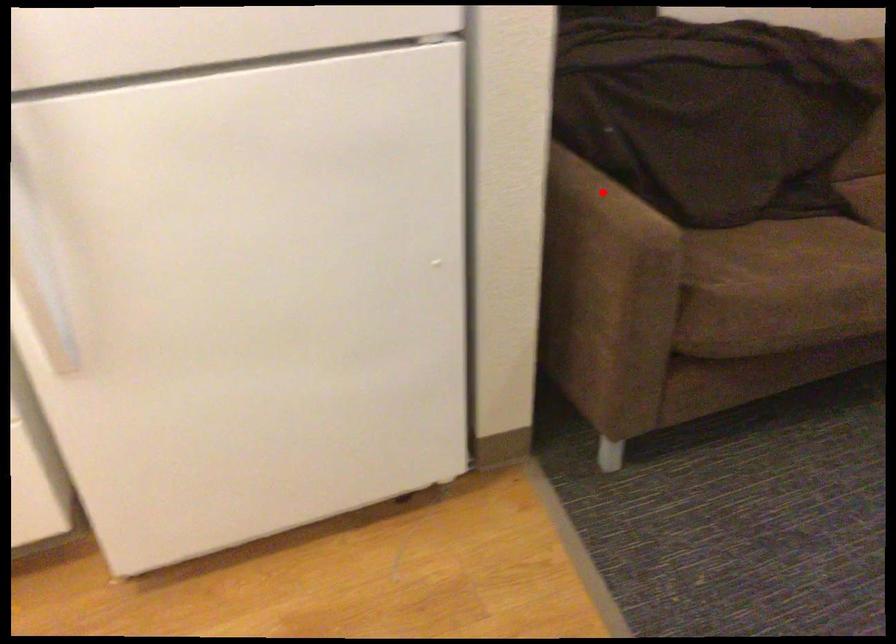
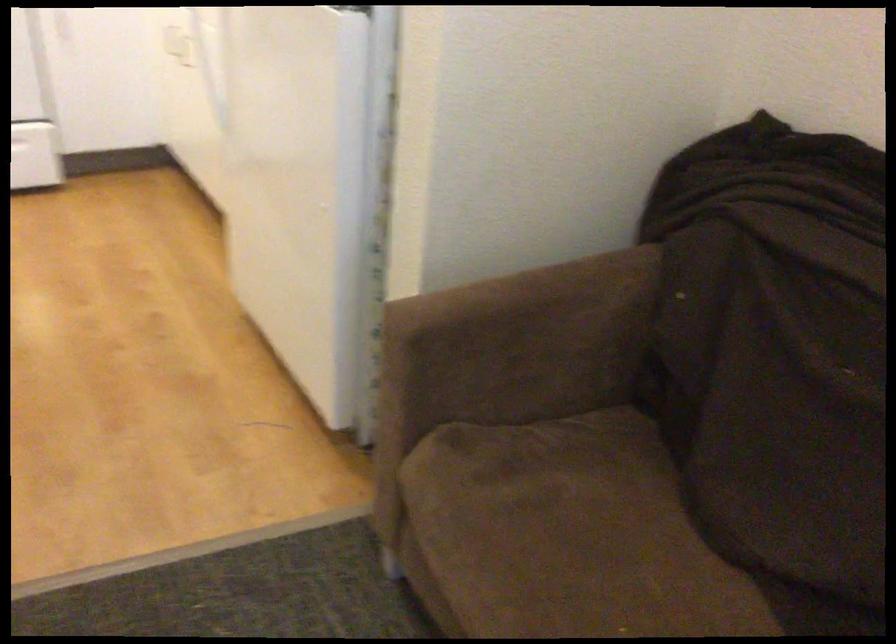
Question: I am providing you with two images of the same scene from different viewpoints. A red point is shown in image1. For the corresponding object point in image2, is it positioned nearer or farther from the camera?

Choices:
 (A) Nearer
 (B) Farther

Answer: (A)